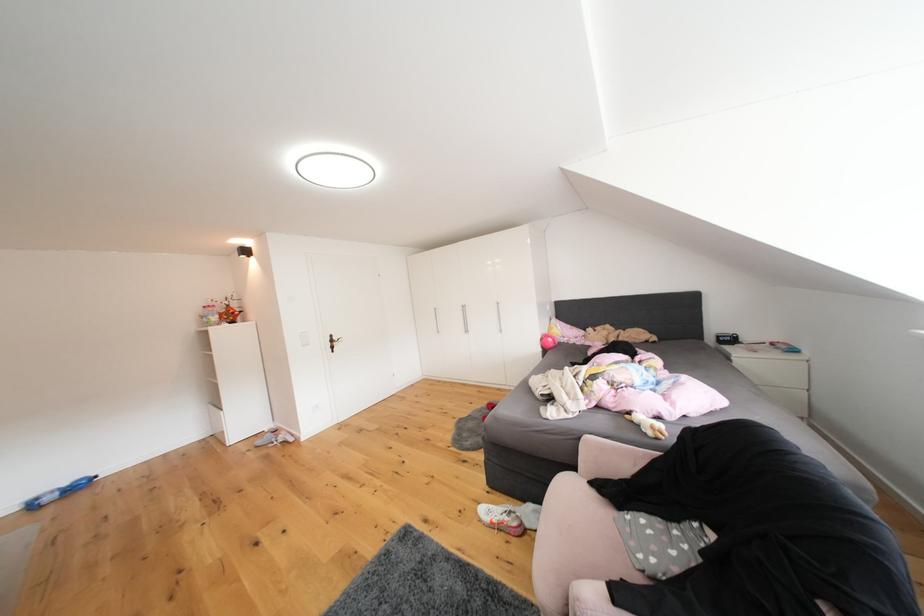
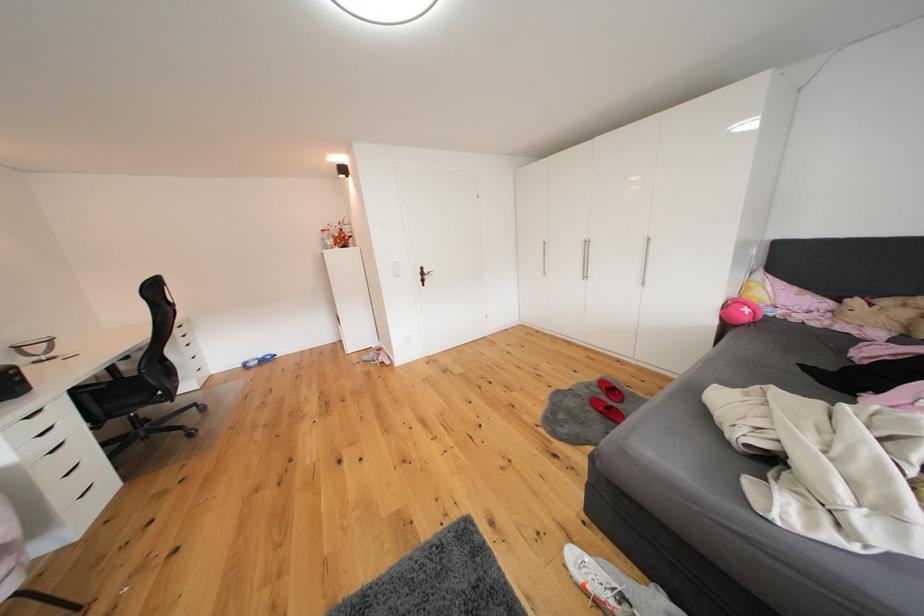
Question: The images are taken continuously from a first-person perspective. In which direction are you moving?

Choices:
 (A) Left
 (B) Right
 (C) Forward
 (D) Backward

Answer: (C)